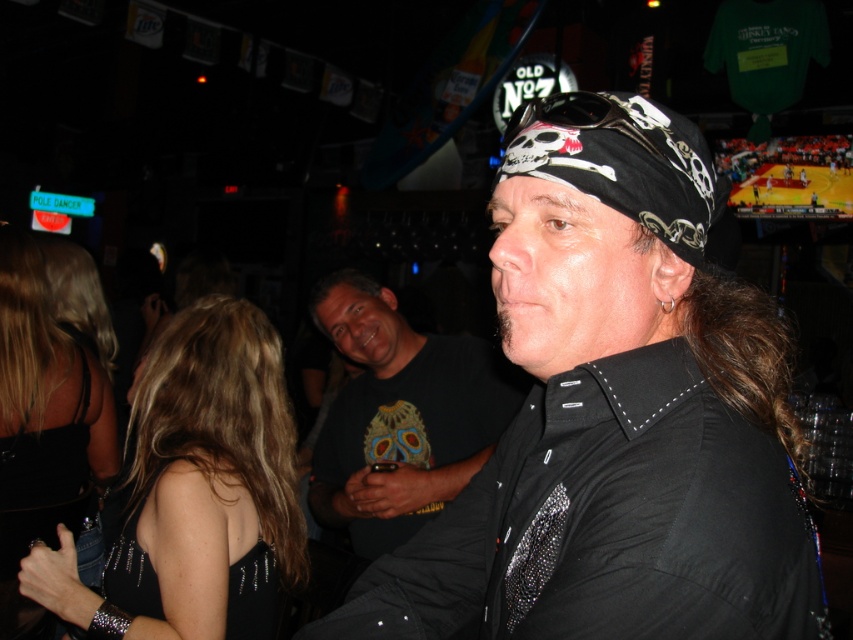
You are standing at the entrance of the bar and want to approach the black satin shirt at center. If the entrance is at coordinate origin, which direction should you move to reach it?

The black satin shirt at center is located at coordinate point 0.648 on the x axis and 0.722 on the y axis. Since the entrance is at the origin, you should move in the positive x and positive y direction to reach it.

You are a photographer positioned at the center of the room. You want to capture a photo that includes both the black satin shirt at center and the black satin dress at lower left. What is the minimum distance you need to move backward to ensure both subjects are in frame?

The minimum distance to move backward would be based on the distance between the black satin shirt at center and the black satin dress at lower left, which is 5.22 feet. To include both in the frame, you need to position yourself far enough back so that your field of view can encompass this 5.22 feet gap between them.